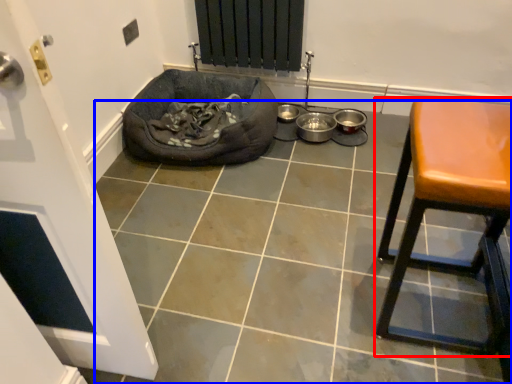
Question: Which point is closer to the camera, furniture (highlighted by a red box) or tile (highlighted by a blue box)?

Choices:
 (A) furniture
 (B) tile

Answer: (A)